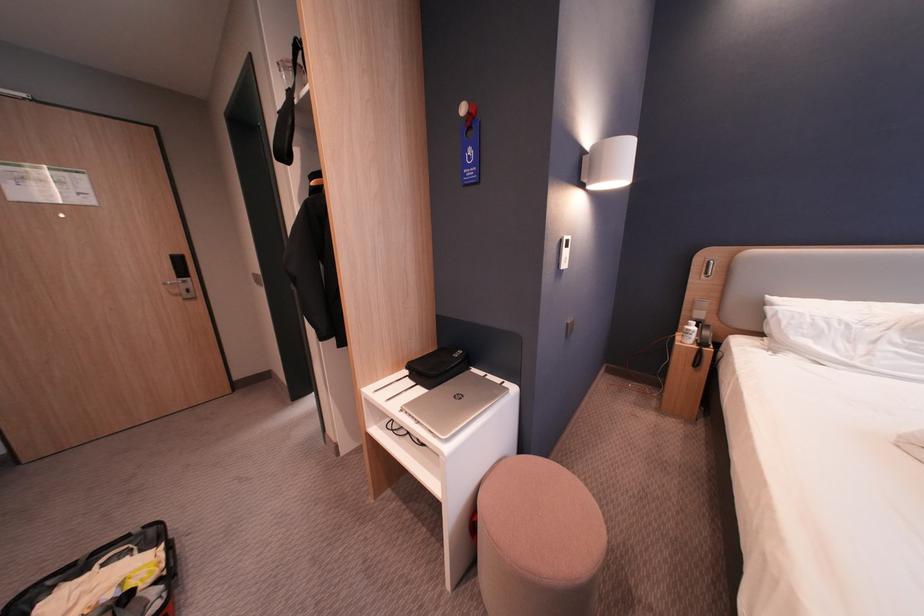
This screenshot has height=616, width=924. What do you see at coordinates (564, 251) in the screenshot?
I see `the white wall switch` at bounding box center [564, 251].